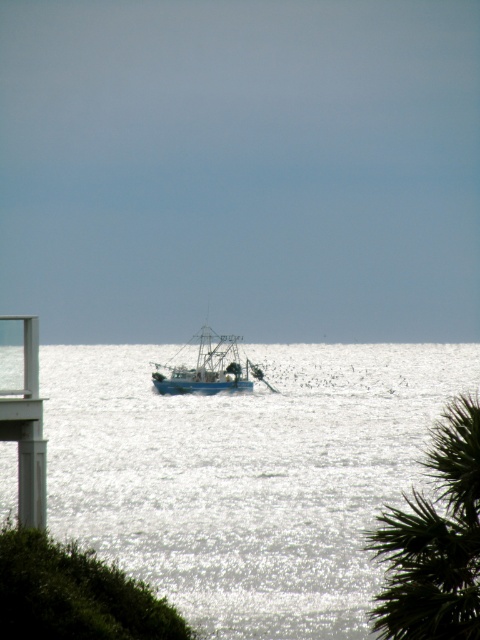
You are a sailor navigating a boat in the image. You notice a specific point marked at coordinates (245, 476). Based on the scene description, what is the location and appearance of the object at this point?

The point at (245, 476) marks glistening silver water at center, which is part of the shimmering ocean surface described in the scene. This area likely reflects sunlight and appears sparkly due to the ripples mentioned.

You are standing on the beach and want to take a photo of the blue matte fishing boat at center. However, there is a green leafy palm tree at lower right in your view. Can you see the boat clearly without the palm tree blocking it?

The green leafy palm tree at lower right is in front of the blue matte fishing boat at center, so the palm tree will block the view of the boat. You cannot see the boat clearly without the palm tree blocking it.